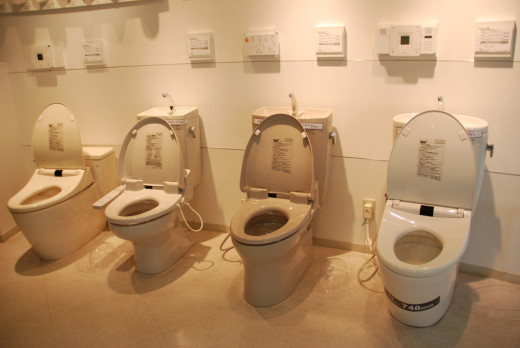
Image resolution: width=520 pixels, height=348 pixels. Find the location of `white walls`. white walls is located at coordinates (366, 87).